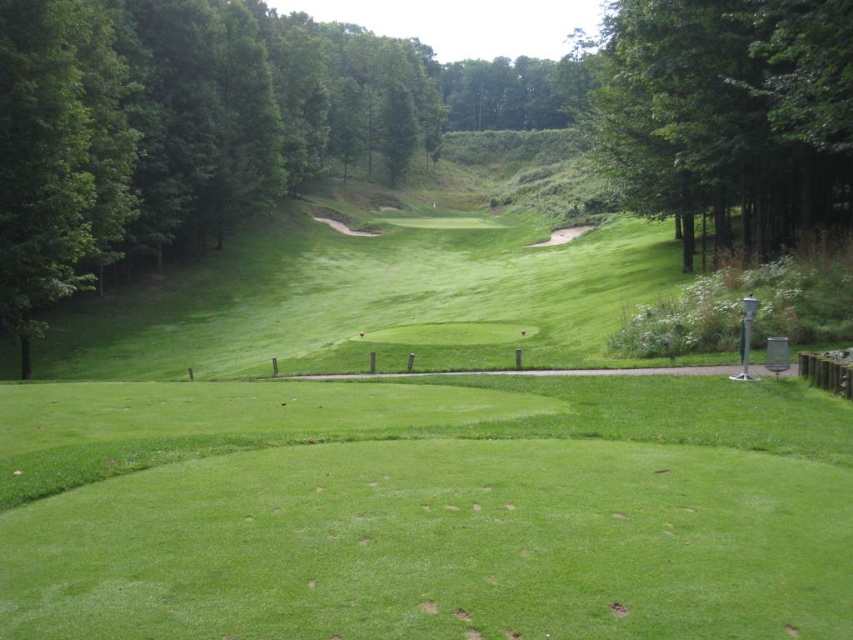
Who is positioned more to the right, green grassy field at center or green leafy tree at upper right?

green leafy tree at upper right

Is green grassy field at center in front of green leafy tree at upper right?

Yes, it is.

I want to click on green grassy field at center, so click(428, 512).

Does green grassy field at center have a larger size compared to green leafy tree at left?

No.

Does green grassy field at center have a greater width compared to green leafy tree at left?

In fact, green grassy field at center might be narrower than green leafy tree at left.

Which is behind, point (497, 401) or point (115, 141)?

Point (115, 141)

In order to click on green grassy field at center in this screenshot , I will do `click(428, 512)`.

Which is in front, point (270, 147) or point (827, 164)?

Point (827, 164) is in front.

Who is lower down, green leafy tree at left or green leafy tree at upper right?

green leafy tree at upper right is lower down.

What do you see at coordinates (178, 128) in the screenshot? This screenshot has width=853, height=640. I see `green leafy tree at left` at bounding box center [178, 128].

Identify the location of green leafy tree at left. The height and width of the screenshot is (640, 853). (178, 128).